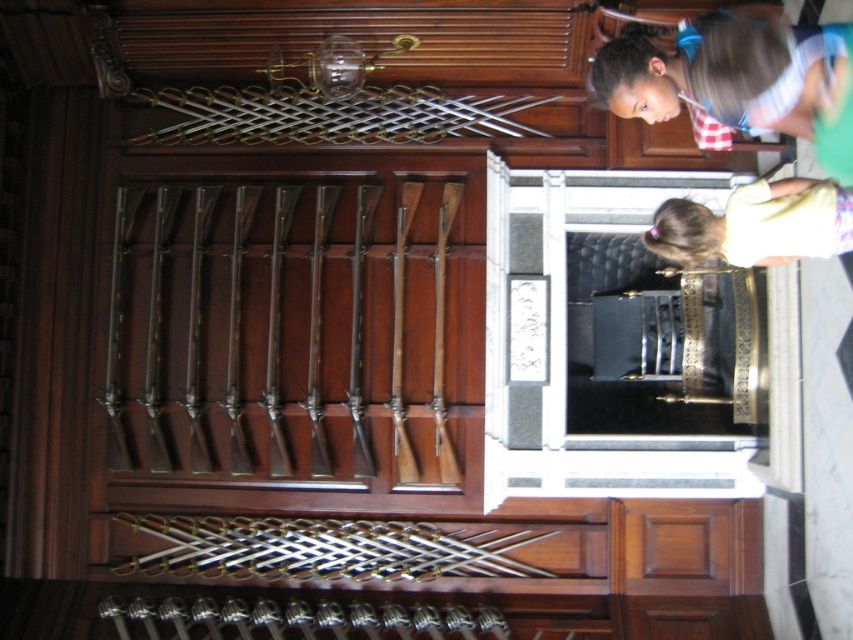
Can you confirm if light yellow shirt at lower right is bigger than polished silver rifle at center?

Yes.

Can you confirm if light yellow shirt at lower right is thinner than polished silver rifle at center?

No.

Is point (746, 209) positioned in front of point (282, 454)?

Yes.

The height and width of the screenshot is (640, 853). I want to click on light yellow shirt at lower right, so click(756, 225).

Is light yellow shirt at lower right to the right of polished wood rifle at center from the viewer's perspective?

Correct, you'll find light yellow shirt at lower right to the right of polished wood rifle at center.

Can you confirm if light yellow shirt at lower right is smaller than polished wood rifle at center?

No, light yellow shirt at lower right is not smaller than polished wood rifle at center.

The width and height of the screenshot is (853, 640). I want to click on light yellow shirt at lower right, so click(756, 225).

Does polished brass rifle at center have a smaller size compared to brown wooden rifle at center?

No.

Can you confirm if polished brass rifle at center is bigger than brown wooden rifle at center?

Indeed, polished brass rifle at center has a larger size compared to brown wooden rifle at center.

Measure the distance between polished brass rifle at center and camera.

polished brass rifle at center and camera are 20.30 feet apart from each other.

At what (x,y) coordinates should I click in order to perform the action: click on polished brass rifle at center. Please return your answer as a coordinate pair (x, y). Looking at the image, I should click on (358, 330).